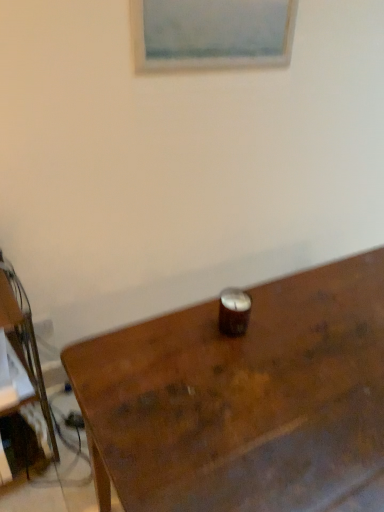
Question: Is wooden table at center a part of matte white picture frame at upper center?

Choices:
 (A) no
 (B) yes

Answer: (A)

Question: From the image's perspective, is matte white picture frame at upper center above wooden table at center?

Choices:
 (A) no
 (B) yes

Answer: (B)

Question: Considering the relative sizes of matte white picture frame at upper center and wooden table at center in the image provided, is matte white picture frame at upper center bigger than wooden table at center?

Choices:
 (A) no
 (B) yes

Answer: (A)

Question: Is matte white picture frame at upper center taller than wooden table at center?

Choices:
 (A) yes
 (B) no

Answer: (B)

Question: Does matte white picture frame at upper center have a greater width compared to wooden table at center?

Choices:
 (A) yes
 (B) no

Answer: (B)

Question: Is wooden table at center taller or shorter than brown wooden desk at left?

Choices:
 (A) tall
 (B) short

Answer: (B)

Question: Is wooden table at center to the left or to the right of brown wooden desk at left in the image?

Choices:
 (A) left
 (B) right

Answer: (B)

Question: Considering the positions of wooden table at center and brown wooden desk at left in the image, is wooden table at center wider or thinner than brown wooden desk at left?

Choices:
 (A) thin
 (B) wide

Answer: (B)

Question: From a real-world perspective, is wooden table at center physically located above or below brown wooden desk at left?

Choices:
 (A) below
 (B) above

Answer: (B)

Question: From a real-world perspective, is wooden table at center positioned above or below matte white picture frame at upper center?

Choices:
 (A) below
 (B) above

Answer: (A)

Question: Based on their sizes in the image, would you say wooden table at center is bigger or smaller than matte white picture frame at upper center?

Choices:
 (A) small
 (B) big

Answer: (B)

Question: In terms of height, does wooden table at center look taller or shorter compared to matte white picture frame at upper center?

Choices:
 (A) short
 (B) tall

Answer: (B)

Question: Considering the relative positions of wooden table at center and matte white picture frame at upper center in the image provided, is wooden table at center to the left or to the right of matte white picture frame at upper center?

Choices:
 (A) left
 (B) right

Answer: (B)

Question: Considering the positions of brown wooden desk at left and matte white picture frame at upper center in the image, is brown wooden desk at left taller or shorter than matte white picture frame at upper center?

Choices:
 (A) short
 (B) tall

Answer: (B)

Question: Is brown wooden desk at left situated inside matte white picture frame at upper center or outside?

Choices:
 (A) outside
 (B) inside

Answer: (A)